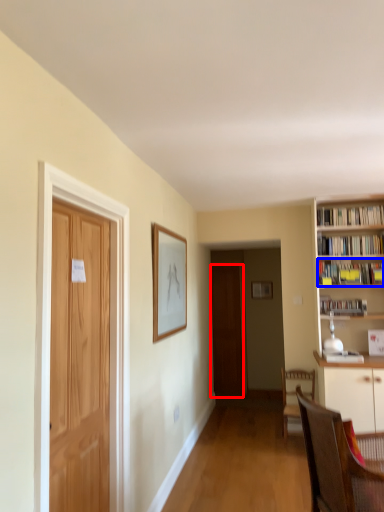
Question: Which point is further to the camera, door (highlighted by a red box) or book (highlighted by a blue box)?

Choices:
 (A) door
 (B) book

Answer: (A)